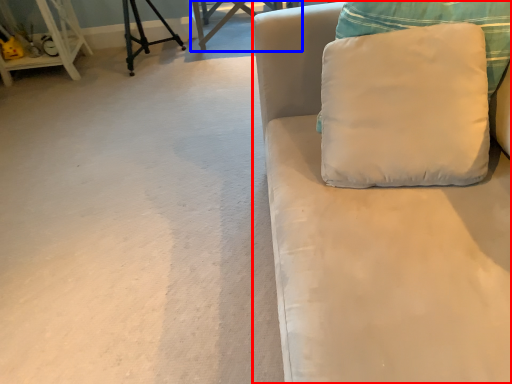
Question: Which object is further to the camera taking this photo, studio couch (highlighted by a red box) or table (highlighted by a blue box)?

Choices:
 (A) studio couch
 (B) table

Answer: (B)